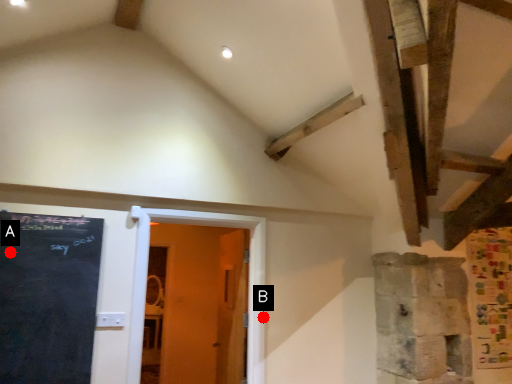
Question: Two points are circled on the image, labeled by A and B beside each circle. Which point is further to the camera?

Choices:
 (A) A is further
 (B) B is further

Answer: (B)